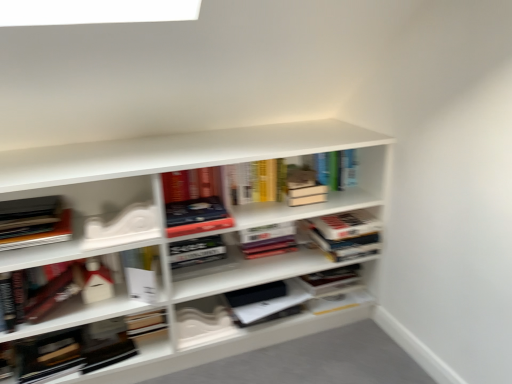
Question: Considering the positions of white matte bookshelf at center and white matte box at left, acting as the 2th book starting from the left, in the image, is white matte bookshelf at center bigger or smaller than white matte box at left, acting as the 2th book starting from the left,?

Choices:
 (A) big
 (B) small

Answer: (A)

Question: Relative to white matte box at left, acting as the 2th book starting from the left, is white matte bookshelf at center in front or behind?

Choices:
 (A) behind
 (B) front

Answer: (B)

Question: Estimate the real-world distances between objects in this image. Which object is closer to the hardcover book at upper center, arranged as the 5th book when viewed from the left?

Choices:
 (A) hardcover book at center, arranged as the 4th book when viewed from the left
 (B) matte black book at left, placed as the 6th book when sorted from right to left
 (C) white matte bookshelf at center
 (D) white paper at center, which is the third book from left to right
 (E) matte hardcover book at center

Answer: (A)

Question: Which is nearer to the white paper at center, which is the third book from left to right?

Choices:
 (A) white matte bookshelf at center
 (B) hardcover book at upper center, the second book positioned from the right
 (C) hardcover book at center, which is the third book from right to left
 (D) matte black book at left, placed as the 6th book when sorted from right to left
 (E) hardcover book at center, which is the first book in right-to-left order

Answer: (D)